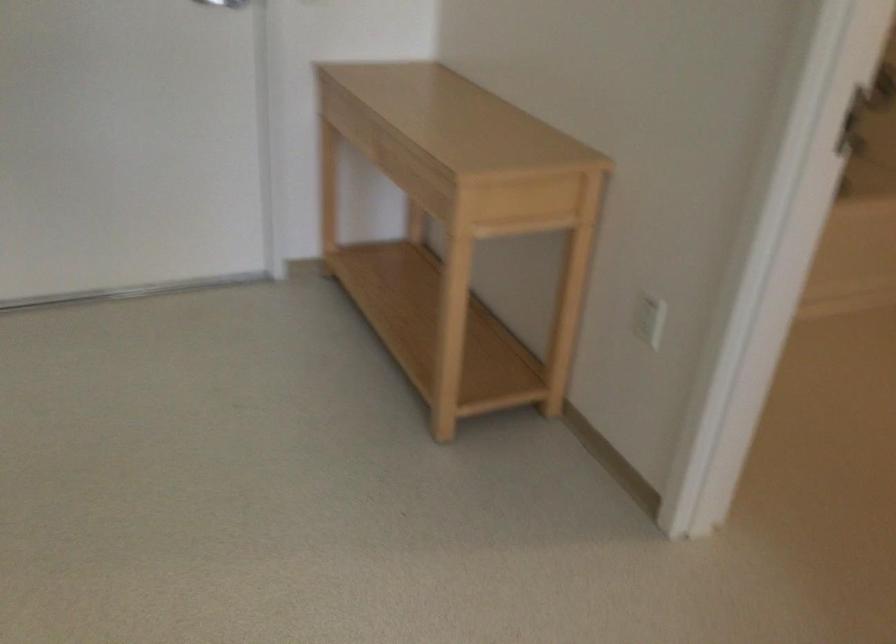
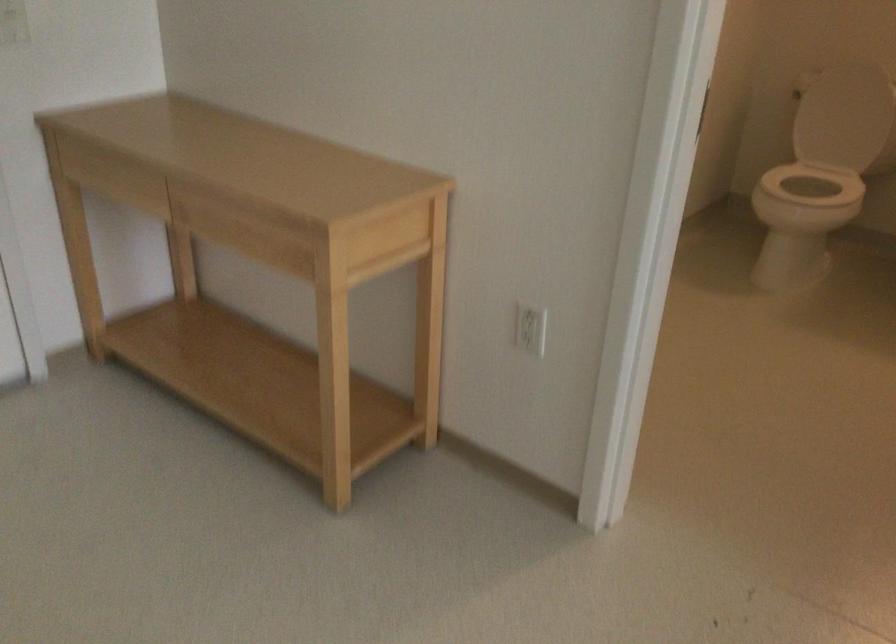
Question: How did the camera likely rotate?

Choices:
 (A) Left
 (B) Right
 (C) Up
 (D) Down

Answer: (B)